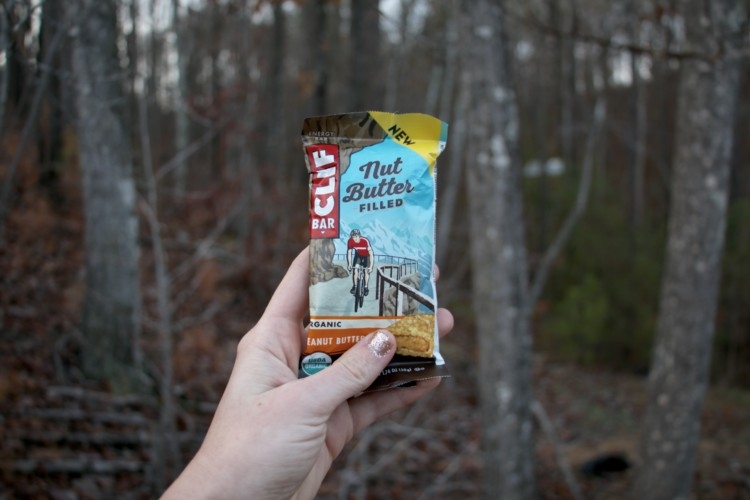
What are the coordinates of `shoe` in the screenshot? It's located at (352, 287), (368, 290).